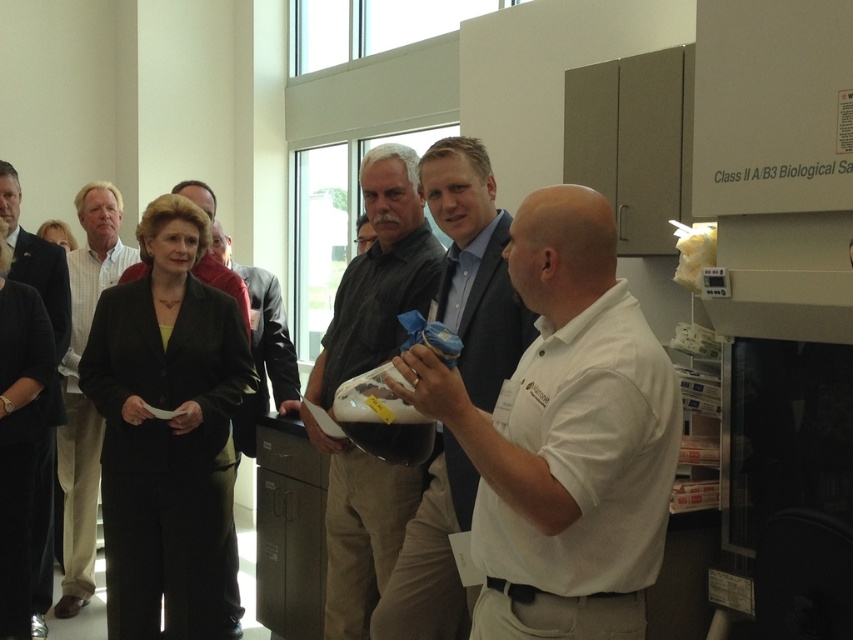
Question: Can you confirm if light brown shirt at center is smaller than dark suit jacket at center?

Choices:
 (A) no
 (B) yes

Answer: (B)

Question: Which point is farther to the camera?

Choices:
 (A) dark suit jacket at center
 (B) matte black shirt at center
 (C) white matte shirt at center

Answer: (A)

Question: Which point is farther to the camera?

Choices:
 (A) (453, 493)
 (B) (82, 317)
 (C) (320, 390)

Answer: (B)

Question: Considering the relative positions of white matte shirt at center and dark suit jacket at center in the image provided, where is white matte shirt at center located with respect to dark suit jacket at center?

Choices:
 (A) right
 (B) left

Answer: (A)

Question: Does dark suit jacket at center appear on the right side of black fabric suit at center?

Choices:
 (A) yes
 (B) no

Answer: (B)

Question: Which point is farther to the camera?

Choices:
 (A) (234, 600)
 (B) (421, 227)
 (C) (502, 291)

Answer: (A)